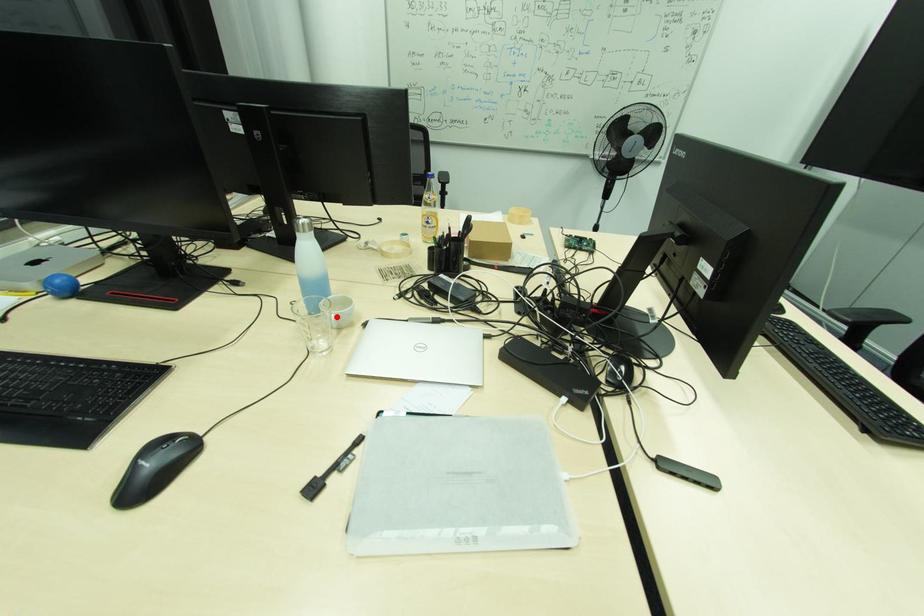
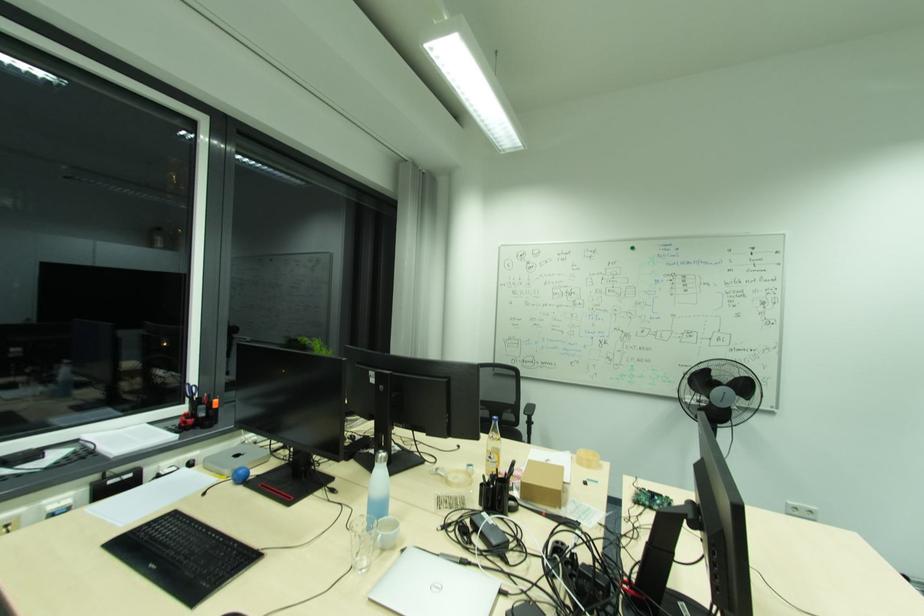
Find the pixel in the second image that matches the highlighted location in the first image.

(383, 537)